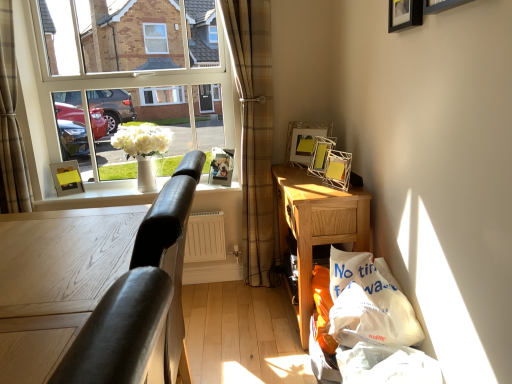
Question: From the image's perspective, is black leather table at left positioned above or below matte yellow picture frame at left, arranged as the fifth picture frame when viewed from the front?

Choices:
 (A) above
 (B) below

Answer: (B)

Question: Considering the positions of point (80, 264) and point (60, 162), is point (80, 264) closer or farther from the camera than point (60, 162)?

Choices:
 (A) farther
 (B) closer

Answer: (B)

Question: Considering the real-world distances, which object is closest to the white glossy window sill at center?

Choices:
 (A) white ceramic vase at window
 (B) metallic silver picture frame at upper right, the 3th picture frame positioned from the back
 (C) wooden picture frame at upper right, placed as the sixth picture frame when sorted from back to front
 (D) black matte picture frame at upper right, the second picture frame viewed from the right
 (E) wooden desk at lower right

Answer: (A)

Question: Estimate the real-world distances between objects in this image. Which object is farther from the metallic silver picture frame at upper right, which appears as the fourth picture frame when viewed from the right?

Choices:
 (A) metallic silver photo frame at center, which is the first picture frame from back to front
 (B) metallic silver picture frame at upper center, the third picture frame from the right
 (C) black leather table at left
 (D) wooden desk at lower right
 (E) white plastic bag at lower right

Answer: (C)